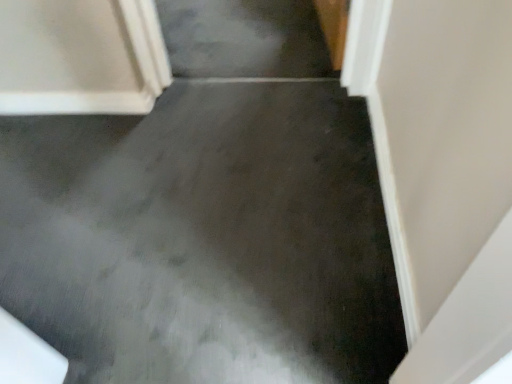
At what (x,y) coordinates should I click in order to perform the action: click on vacant space situated above gray concrete at center (from a real-world perspective). Please return your answer as a coordinate pair (x, y). Image resolution: width=512 pixels, height=384 pixels. Looking at the image, I should click on (221, 268).